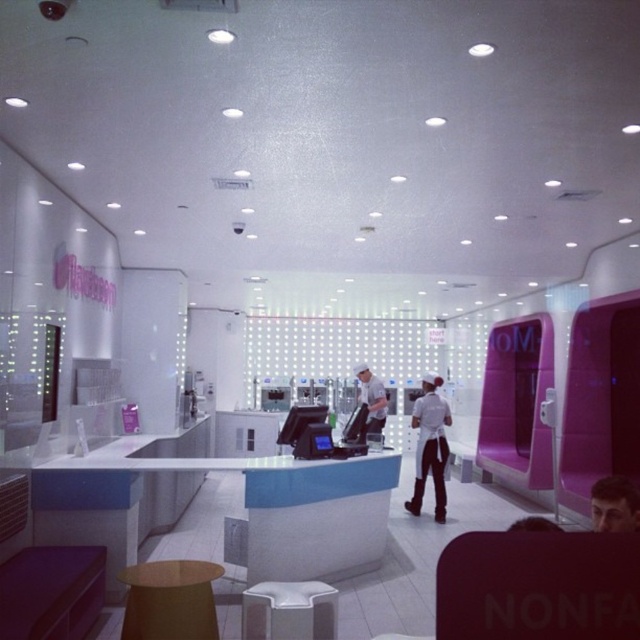
You are a customer in the ice cream shop and want to sit down. There are two stools available, the brown leather stool at lower center and the white plastic stool at center. If you want to sit as close as possible to the counter, which stool should you choose?

The brown leather stool at lower center is closer to the counter than the white plastic stool at center, so you should choose the brown leather stool at lower center to sit as close as possible to the counter.

You are a customer in the ice cream shop and want to know which of the two points, point [168,573] or point [380,417], is closer to you. Can you determine this based on the scene?

Point [168,573] is closer to the viewer than point [380,417].

You are a customer in the ice cream shop and want to sit on the brown leather stool at lower center. However, there is a white fabric apron at center in the way. Can you reach the stool without moving the apron?

The brown leather stool at lower center is shorter than the white fabric apron at center, so you can reach the stool without moving the apron because it is lower than the apron.